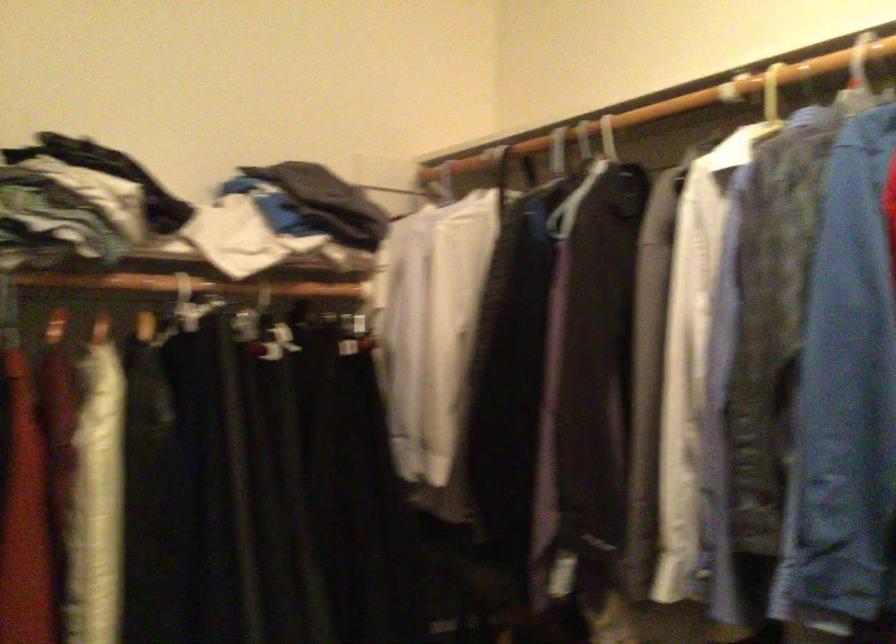
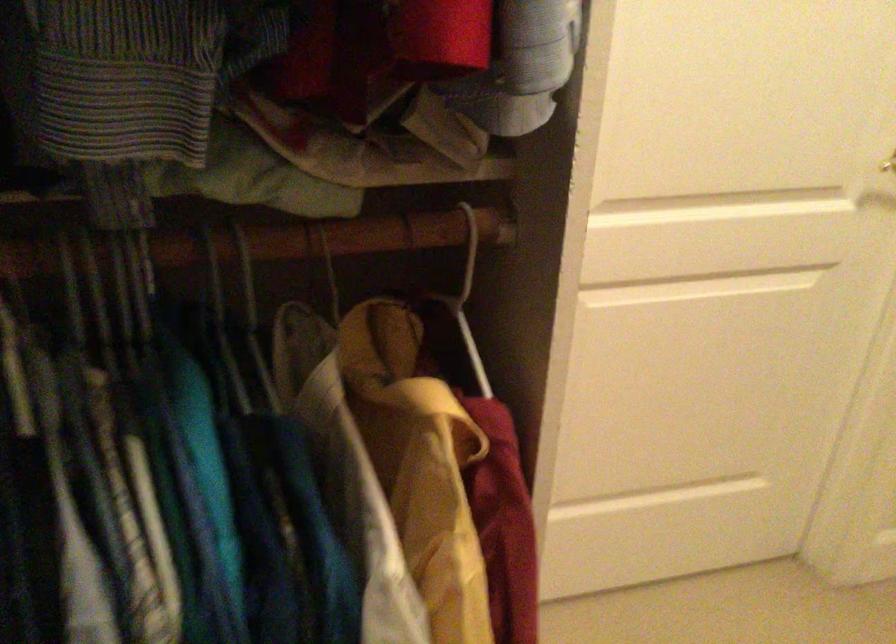
Based on the continuous images, in which direction is the camera rotating?

The rotation direction of the camera is right-down.